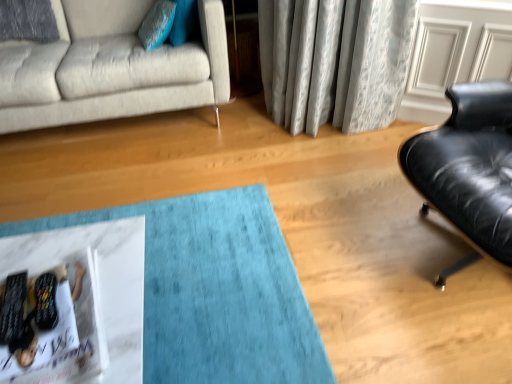
Question: Can you confirm if light gray fabric couch at upper left is taller than teal fabric pillow at upper left?

Choices:
 (A) yes
 (B) no

Answer: (A)

Question: From the image's perspective, is light gray fabric couch at upper left over teal fabric pillow at upper left?

Choices:
 (A) yes
 (B) no

Answer: (B)

Question: Is light gray fabric couch at upper left placed right next to teal fabric pillow at upper left?

Choices:
 (A) no
 (B) yes

Answer: (A)

Question: From the image's perspective, is light gray fabric couch at upper left below teal fabric pillow at upper left?

Choices:
 (A) no
 (B) yes

Answer: (B)

Question: Considering the relative positions of light gray fabric couch at upper left and teal fabric pillow at upper left in the image provided, is light gray fabric couch at upper left behind teal fabric pillow at upper left?

Choices:
 (A) yes
 (B) no

Answer: (B)

Question: Is teal fabric pillow at upper left located within light gray fabric couch at upper left?

Choices:
 (A) no
 (B) yes

Answer: (B)

Question: Is teal fabric pillow at upper left to the left of light gray fabric couch at upper left from the viewer's perspective?

Choices:
 (A) no
 (B) yes

Answer: (A)

Question: Considering the relative sizes of teal fabric pillow at upper left and light gray fabric couch at upper left in the image provided, is teal fabric pillow at upper left smaller than light gray fabric couch at upper left?

Choices:
 (A) yes
 (B) no

Answer: (A)

Question: Is teal fabric pillow at upper left turned away from light gray fabric couch at upper left?

Choices:
 (A) yes
 (B) no

Answer: (A)

Question: Is teal fabric pillow at upper left taller than light gray fabric couch at upper left?

Choices:
 (A) no
 (B) yes

Answer: (A)

Question: Considering the relative positions of teal fabric pillow at upper left and light gray fabric couch at upper left in the image provided, is teal fabric pillow at upper left to the right of light gray fabric couch at upper left from the viewer's perspective?

Choices:
 (A) no
 (B) yes

Answer: (B)

Question: Does teal fabric pillow at upper left have a lesser width compared to light gray fabric couch at upper left?

Choices:
 (A) no
 (B) yes

Answer: (B)

Question: Is white glossy magazine at lower left bigger than light gray fabric couch at upper left?

Choices:
 (A) yes
 (B) no

Answer: (B)